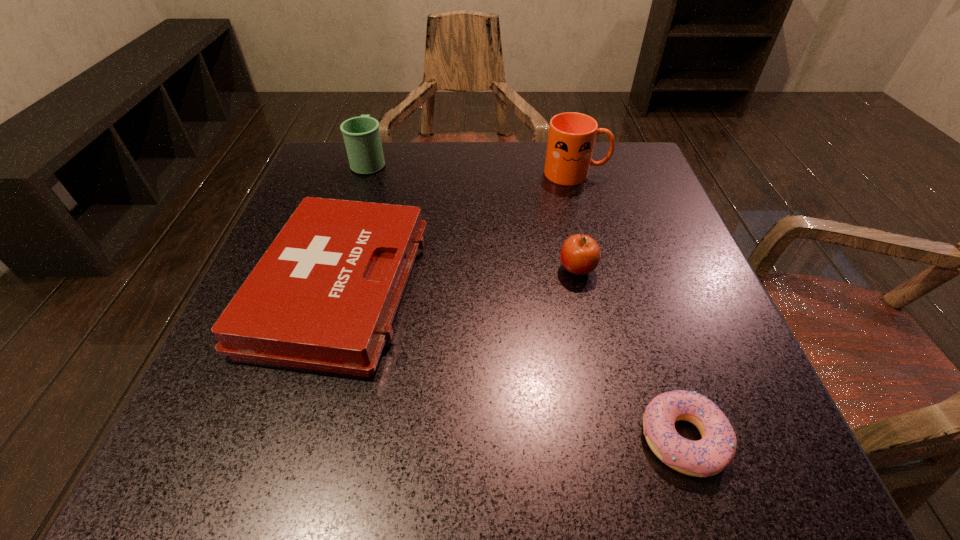
Where is `the tallest object`? Image resolution: width=960 pixels, height=540 pixels. the tallest object is located at coordinates (571, 138).

Where is `the taller mug`? This screenshot has width=960, height=540. the taller mug is located at coordinates (571, 138).

This screenshot has height=540, width=960. I want to click on the shorter mug, so click(361, 134).

Where is `apple`? The image size is (960, 540). apple is located at coordinates (580, 254).

Locate an element on the screen. Image resolution: width=960 pixels, height=540 pixels. the first-aid kit is located at coordinates (324, 295).

Locate an element on the screen. the nearest object is located at coordinates (709, 456).

Find the location of a particular element. the shortest object is located at coordinates (709, 456).

This screenshot has width=960, height=540. Identify the location of free region located 0.090m on the right of the apple. (645, 269).

This screenshot has width=960, height=540. In order to click on vacant space located 0.260m on the back of the second shortest object in this screenshot , I will do point(379,154).

In order to click on vacant space located 0.060m on the left of the nearest object in this screenshot , I will do `click(595, 438)`.